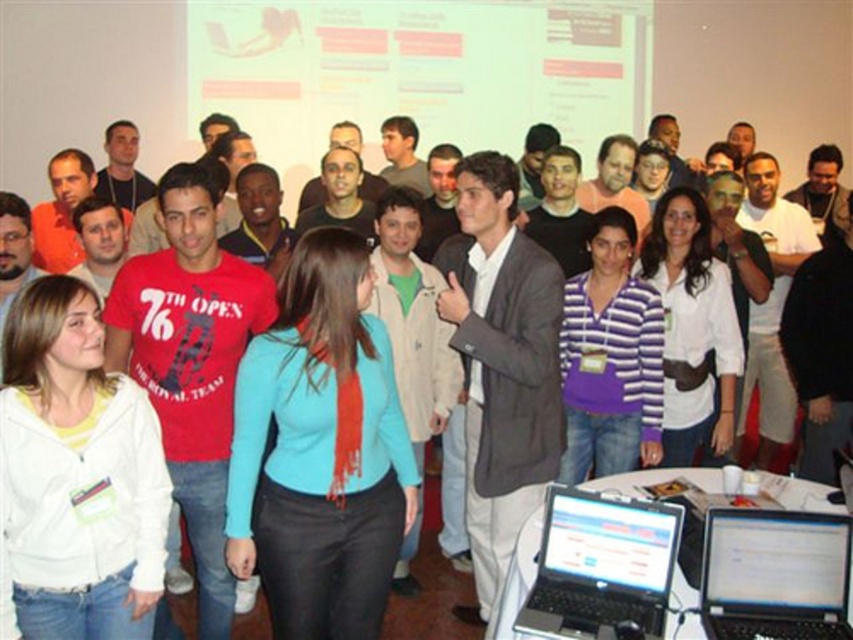
Question: Is dark gray suit at center wider than matte red t-shirt at center?

Choices:
 (A) no
 (B) yes

Answer: (A)

Question: Which point is closer to the camera taking this photo?

Choices:
 (A) (515, 497)
 (B) (294, 301)
 (C) (231, 378)
 (D) (561, 547)

Answer: (D)

Question: Which object is farther from the camera taking this photo?

Choices:
 (A) matte red t-shirt at center
 (B) dark gray suit at center
 (C) blue fabric sweater at center
 (D) silver metallic laptop at lower center

Answer: (B)

Question: Does dark gray suit at center have a smaller size compared to silver metallic laptop at lower center?

Choices:
 (A) yes
 (B) no

Answer: (B)

Question: Which point is farther to the camera?

Choices:
 (A) black plastic laptop at lower right
 (B) blue fabric sweater at center

Answer: (B)

Question: Can you confirm if blue fabric sweater at center is positioned above silver metallic laptop at lower center?

Choices:
 (A) yes
 (B) no

Answer: (A)